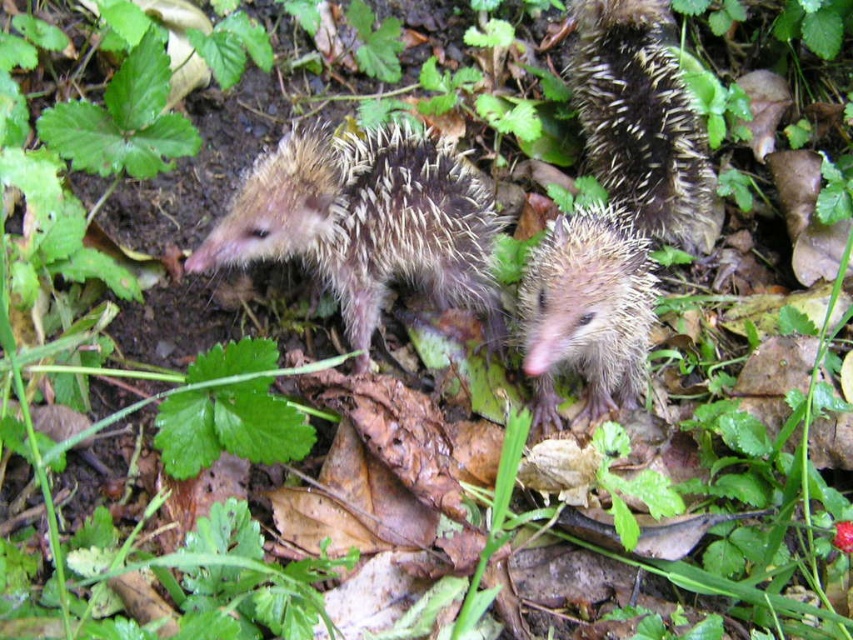
You are a researcher observing the hedgehogs in this scene. You need to determine which hedgehog is bigger. Can you compare the size of the spiky brown hedgehog at upper right and the brown spiny hedgehog at center?

The spiky brown hedgehog at upper right is larger in width than the brown spiny hedgehog at center.

You are a wildlife photographer aiming to capture a closeup shot of both the fuzzy brown hedgehog at center and the brown spiny hedgehog at center. Your camera has a maximum focus range of 30 centimeters. Can you fit both hedgehogs into the frame without moving the camera?

The distance between the fuzzy brown hedgehog at center and the brown spiny hedgehog at center is 28.83 centimeters, which is within the camera maximum focus range of 30 centimeters. Therefore, you can fit both hedgehogs into the frame without moving the camera.

You are standing in the outdoor scene with the three hedgehogs. You notice two points marked in the image. Which point is closer to you, point (x=666, y=4) or point (x=550, y=394)?

Point (x=666, y=4) is closer to you than point (x=550, y=394) because it is further to the viewer.